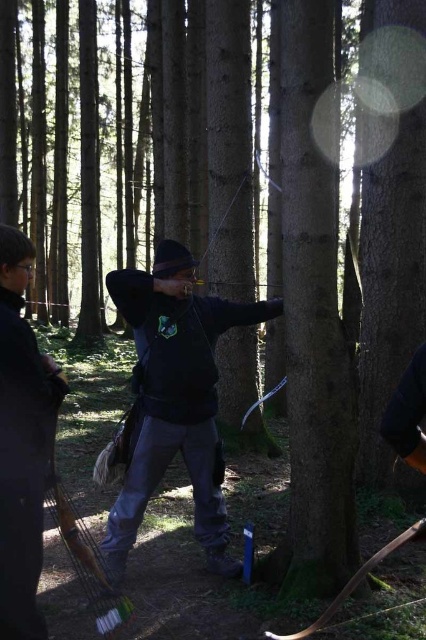
Question: Can you confirm if dark blue fabric jacket at center is thinner than black matte jacket at center?

Choices:
 (A) yes
 (B) no

Answer: (B)

Question: Which point is farther to the camera?

Choices:
 (A) black matte jacket at center
 (B) dark blue fabric jacket at center

Answer: (B)

Question: Which object appears farthest from the camera in this image?

Choices:
 (A) black matte jacket at center
 (B) dark blue fabric jacket at center

Answer: (B)

Question: Does dark blue fabric jacket at center have a lesser width compared to black matte jacket at center?

Choices:
 (A) yes
 (B) no

Answer: (B)

Question: From the image, what is the correct spatial relationship of dark blue fabric jacket at center in relation to black matte jacket at center?

Choices:
 (A) below
 (B) above

Answer: (A)